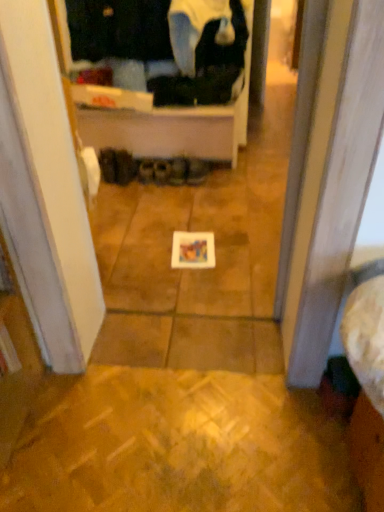
In order to face brown suede boot at center, which appears as the fifth footwear when viewed from the right, should I rotate leftwards or rightwards?

Rotate your view left by about 8.564°.

How much space does black fabric shoes at center, marked as the 1th footwear in a left-to-right arrangement, occupy vertically?

black fabric shoes at center, marked as the 1th footwear in a left-to-right arrangement, is 7.95 inches in height.

What do you see at coordinates (108, 165) in the screenshot? This screenshot has width=384, height=512. I see `black fabric shoes at center, which is counted as the sixth footwear, starting from the right` at bounding box center [108, 165].

Image resolution: width=384 pixels, height=512 pixels. Find the location of `black fabric at upper center`. black fabric at upper center is located at coordinates (119, 29).

Measure the distance between brown suede shoes at center, which ranks as the fourth footwear in left-to-right order, and camera.

brown suede shoes at center, which ranks as the fourth footwear in left-to-right order, and camera are 2.75 meters apart.

What do you see at coordinates (196, 170) in the screenshot? I see `leather brown shoes at center, which is counted as the first footwear, starting from the right` at bounding box center [196, 170].

Find the location of a particular element. This screenshot has width=384, height=512. brown suede boot at center, the 2th footwear in the left-to-right sequence is located at coordinates (125, 167).

Are brown suede shoes at center, which ranks as the fourth footwear in left-to-right order, and black fabric at upper center making contact?

No, brown suede shoes at center, which ranks as the fourth footwear in left-to-right order, is not touching black fabric at upper center.

Visually, is brown suede shoes at center, which ranks as the third footwear in right-to-left order, positioned to the left or to the right of black fabric at upper center?

From the image, it's evident that brown suede shoes at center, which ranks as the third footwear in right-to-left order, is to the right of black fabric at upper center.

From the image's perspective, would you say brown suede shoes at center, which ranks as the third footwear in right-to-left order, is shown under black fabric at upper center?

Yes.

From a real-world perspective, is matte black shoes at center, the second footwear from the right, beneath brown suede boot at center, which appears as the fifth footwear when viewed from the right?

Yes, from a real-world perspective, matte black shoes at center, the second footwear from the right, is beneath brown suede boot at center, which appears as the fifth footwear when viewed from the right.

This screenshot has width=384, height=512. In order to click on footwear that is the 2nd one when counting downward from the brown suede boot at center, which appears as the fifth footwear when viewed from the right (from the image's perspective) in this screenshot , I will do `click(178, 170)`.

Is matte black shoes at center, the 5th footwear when ordered from left to right, aimed at brown suede boot at center, which appears as the fifth footwear when viewed from the right?

No, matte black shoes at center, the 5th footwear when ordered from left to right, does not turn towards brown suede boot at center, which appears as the fifth footwear when viewed from the right.

Is matte black shoes at center, the 5th footwear when ordered from left to right, located outside brown suede boot at center, the 2th footwear in the left-to-right sequence?

Absolutely, matte black shoes at center, the 5th footwear when ordered from left to right, is external to brown suede boot at center, the 2th footwear in the left-to-right sequence.

Considering the relative sizes of matte black shoes at center, the 5th footwear when ordered from left to right, and black fabric shoes at center, the 3th footwear when ordered from left to right, in the image provided, is matte black shoes at center, the 5th footwear when ordered from left to right, taller than black fabric shoes at center, the 3th footwear when ordered from left to right,?

Indeed, matte black shoes at center, the 5th footwear when ordered from left to right, has a greater height compared to black fabric shoes at center, the 3th footwear when ordered from left to right.

Considering the positions of points (177, 164) and (145, 165), is point (177, 164) farther from camera compared to point (145, 165)?

No, (177, 164) is in front of (145, 165).

Based on their sizes in the image, would you say matte black shoes at center, the second footwear from the right, is bigger or smaller than black fabric shoes at center, the 3th footwear when ordered from left to right?

Clearly, matte black shoes at center, the second footwear from the right, is larger in size than black fabric shoes at center, the 3th footwear when ordered from left to right.

Is matte black shoes at center, the second footwear from the right, oriented towards black fabric shoes at center, arranged as the 4th footwear when viewed from the right?

No, matte black shoes at center, the second footwear from the right, is not aimed at black fabric shoes at center, arranged as the 4th footwear when viewed from the right.

Measure the distance between brown suede boot at center, which appears as the fifth footwear when viewed from the right, and brown suede shoes at center, which ranks as the third footwear in right-to-left order.

brown suede boot at center, which appears as the fifth footwear when viewed from the right, is 7.35 inches from brown suede shoes at center, which ranks as the third footwear in right-to-left order.

Could you tell me if brown suede boot at center, the 2th footwear in the left-to-right sequence, is turned towards brown suede shoes at center, which ranks as the third footwear in right-to-left order?

No, brown suede boot at center, the 2th footwear in the left-to-right sequence, is not turned towards brown suede shoes at center, which ranks as the third footwear in right-to-left order.

From the image's perspective, is brown suede boot at center, which appears as the fifth footwear when viewed from the right, over brown suede shoes at center, which ranks as the third footwear in right-to-left order?

Yes.

Who is smaller, black fabric at upper center or brown suede boot at center, which appears as the fifth footwear when viewed from the right?

With smaller size is brown suede boot at center, which appears as the fifth footwear when viewed from the right.

From the image's perspective, which one is positioned higher, black fabric at upper center or brown suede boot at center, the 2th footwear in the left-to-right sequence?

black fabric at upper center, from the image's perspective.

Between black fabric at upper center and brown suede boot at center, the 2th footwear in the left-to-right sequence, which one is positioned in front?

black fabric at upper center is closer to the camera.

From a real-world perspective, is black fabric at upper center over brown suede boot at center, which appears as the fifth footwear when viewed from the right?

Yes, from a real-world perspective, black fabric at upper center is over brown suede boot at center, which appears as the fifth footwear when viewed from the right

Which of these two, brown suede shoes at center, which ranks as the third footwear in right-to-left order, or leather brown shoes at center, which is counted as the first footwear, starting from the right, is bigger?

leather brown shoes at center, which is counted as the first footwear, starting from the right, is bigger.

Which is correct: brown suede shoes at center, which ranks as the third footwear in right-to-left order, is inside leather brown shoes at center, which is counted as the first footwear, starting from the right, or outside of it?

brown suede shoes at center, which ranks as the third footwear in right-to-left order, is outside leather brown shoes at center, which is counted as the first footwear, starting from the right.

Is brown suede shoes at center, which ranks as the third footwear in right-to-left order, far away from leather brown shoes at center, the sixth footwear from the left?

brown suede shoes at center, which ranks as the third footwear in right-to-left order, is near leather brown shoes at center, the sixth footwear from the left, not far away.

From a real-world perspective, is brown suede shoes at center, which ranks as the third footwear in right-to-left order, physically below leather brown shoes at center, which is counted as the first footwear, starting from the right?

Yes, from a real-world perspective, brown suede shoes at center, which ranks as the third footwear in right-to-left order, is under leather brown shoes at center, which is counted as the first footwear, starting from the right.

The height and width of the screenshot is (512, 384). Identify the location of the 5th footwear to the left of the leather brown shoes at center, which is counted as the first footwear, starting from the right, starting your count from the anchor. (108, 165).

Would you say leather brown shoes at center, which is counted as the first footwear, starting from the right, is inside or outside black fabric shoes at center, marked as the 1th footwear in a left-to-right arrangement?

leather brown shoes at center, which is counted as the first footwear, starting from the right, cannot be found inside black fabric shoes at center, marked as the 1th footwear in a left-to-right arrangement.

Is black fabric shoes at center, marked as the 1th footwear in a left-to-right arrangement, at the back of leather brown shoes at center, the sixth footwear from the left?

leather brown shoes at center, the sixth footwear from the left, is not turned away from black fabric shoes at center, marked as the 1th footwear in a left-to-right arrangement.

You are a GUI agent. You are given a task and a screenshot of the screen. Output one action in this format:
    pyautogui.click(x=<x>, y=<y>)
    Task: Click on the 5th footwear behind the black fabric at upper center
    Image resolution: width=384 pixels, height=512 pixels.
    Given the screenshot: What is the action you would take?
    pyautogui.click(x=162, y=170)

There is a matte black shoes at center, the second footwear from the right. Where is `the 2nd footwear above it (from a real-world perspective)`? The image size is (384, 512). the 2nd footwear above it (from a real-world perspective) is located at coordinates (125, 167).

From the image, which object appears to be farther from leather brown shoes at center, which is counted as the first footwear, starting from the right, brown suede shoes at center, which ranks as the third footwear in right-to-left order, or matte black shoes at center, the second footwear from the right?

Based on the image, brown suede shoes at center, which ranks as the third footwear in right-to-left order, appears to be further to leather brown shoes at center, which is counted as the first footwear, starting from the right.

Based on their spatial positions, is brown suede boot at center, which appears as the fifth footwear when viewed from the right, or black fabric at upper center closer to black fabric shoes at center, marked as the 1th footwear in a left-to-right arrangement?

The object closer to black fabric shoes at center, marked as the 1th footwear in a left-to-right arrangement, is brown suede boot at center, which appears as the fifth footwear when viewed from the right.

Based on their spatial positions, is black fabric at upper center or black fabric shoes at center, the 3th footwear when ordered from left to right, closer to black fabric shoes at center, which is counted as the sixth footwear, starting from the right?

black fabric shoes at center, the 3th footwear when ordered from left to right, lies closer to black fabric shoes at center, which is counted as the sixth footwear, starting from the right, than the other object.

In the scene shown: Estimate the real-world distances between objects in this image. Which object is closer to black fabric shoes at center, which is counted as the sixth footwear, starting from the right, black fabric at upper center or brown suede shoes at center, which ranks as the fourth footwear in left-to-right order?

Based on the image, brown suede shoes at center, which ranks as the fourth footwear in left-to-right order, appears to be nearer to black fabric shoes at center, which is counted as the sixth footwear, starting from the right.

When comparing their distances from black fabric shoes at center, which is counted as the sixth footwear, starting from the right, does brown suede shoes at center, which ranks as the third footwear in right-to-left order, or black fabric shoes at center, arranged as the 4th footwear when viewed from the right, seem closer?

Based on the image, black fabric shoes at center, arranged as the 4th footwear when viewed from the right, appears to be nearer to black fabric shoes at center, which is counted as the sixth footwear, starting from the right.

Estimate the real-world distances between objects in this image. Which object is closer to brown suede boot at center, which appears as the fifth footwear when viewed from the right, brown suede shoes at center, which ranks as the fourth footwear in left-to-right order, or black fabric at upper center?

brown suede shoes at center, which ranks as the fourth footwear in left-to-right order, is closer to brown suede boot at center, which appears as the fifth footwear when viewed from the right.

Which object lies nearer to the anchor point brown suede shoes at center, which ranks as the third footwear in right-to-left order, black fabric shoes at center, marked as the 1th footwear in a left-to-right arrangement, or matte black shoes at center, the 5th footwear when ordered from left to right?

matte black shoes at center, the 5th footwear when ordered from left to right.

Estimate the real-world distances between objects in this image. Which object is further from brown suede shoes at center, which ranks as the third footwear in right-to-left order, leather brown shoes at center, which is counted as the first footwear, starting from the right, or black fabric shoes at center, which is counted as the sixth footwear, starting from the right?

The object further to brown suede shoes at center, which ranks as the third footwear in right-to-left order, is black fabric shoes at center, which is counted as the sixth footwear, starting from the right.

Find the location of a particular element. Image resolution: width=384 pixels, height=512 pixels. footwear between black fabric shoes at center, the 3th footwear when ordered from left to right, and matte black shoes at center, the 5th footwear when ordered from left to right, from left to right is located at coordinates (162, 170).

Find the location of `footwear between black fabric at upper center and brown suede boot at center, which appears as the fifth footwear when viewed from the right, in the up-down direction`. footwear between black fabric at upper center and brown suede boot at center, which appears as the fifth footwear when viewed from the right, in the up-down direction is located at coordinates (108, 165).

Locate an element on the screen. footwear situated between brown suede boot at center, the 2th footwear in the left-to-right sequence, and brown suede shoes at center, which ranks as the fourth footwear in left-to-right order, from left to right is located at coordinates (146, 170).

The height and width of the screenshot is (512, 384). What are the coordinates of `footwear between brown suede shoes at center, which ranks as the third footwear in right-to-left order, and leather brown shoes at center, which is counted as the first footwear, starting from the right, from left to right` in the screenshot? It's located at (178, 170).